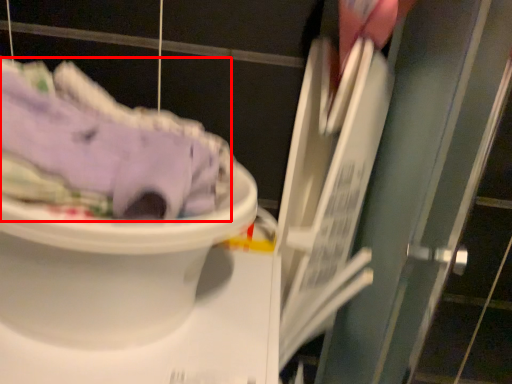
Question: From the image's perspective, considering the relative positions of clothing (annotated by the red box) and toilet in the image provided, where is clothing (annotated by the red box) located with respect to the staircase?

Choices:
 (A) above
 (B) below

Answer: (A)